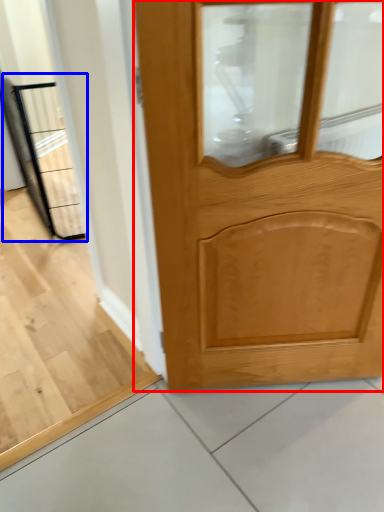
Question: Which object appears farthest to the camera in this image, door (highlighted by a red box) or elevator (highlighted by a blue box)?

Choices:
 (A) door
 (B) elevator

Answer: (B)